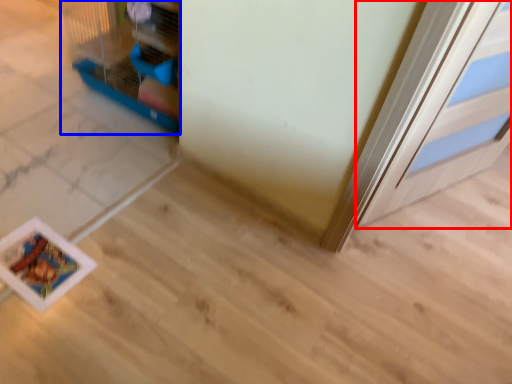
Question: Which object appears farthest to the camera in this image, door (highlighted by a red box) or bird cage (highlighted by a blue box)?

Choices:
 (A) door
 (B) bird cage

Answer: (B)